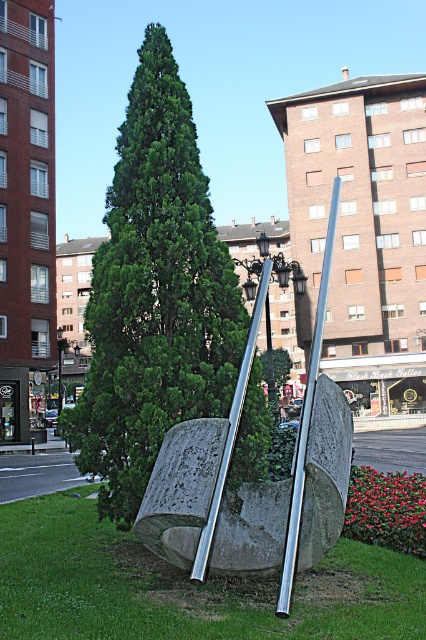
Which is above, green leafy tree at center or polished silver pole at center?

Positioned higher is green leafy tree at center.

Is point (227, 298) positioned in front of point (196, 554)?

No, it is behind (196, 554).

Which is in front, point (80, 401) or point (247, 368)?

Point (247, 368) is more forward.

What are the coordinates of `green leafy tree at center` in the screenshot? It's located at (155, 294).

Is point (146, 429) closer to camera compared to point (134, 604)?

No.

At what (x,y) coordinates should I click in order to perform the action: click on green leafy tree at center. Please return your answer as a coordinate pair (x, y). This screenshot has height=640, width=426. Looking at the image, I should click on (155, 294).

Measure the distance from silver polished pole at center to polished silver pole at center.

8.72 meters

Which of these two, silver polished pole at center or polished silver pole at center, stands shorter?

polished silver pole at center is shorter.

Describe the element at coordinates (307, 417) in the screenshot. I see `silver polished pole at center` at that location.

Locate an element on the screen. This screenshot has height=640, width=426. silver polished pole at center is located at coordinates (307, 417).